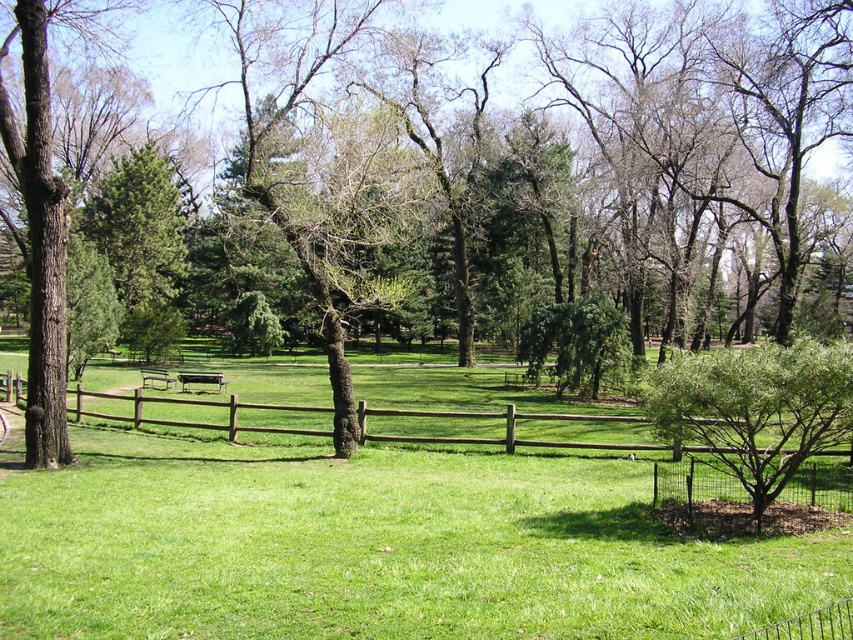
Which is more to the right, brown wood tree at center or green leafy bush at lower right?

From the viewer's perspective, green leafy bush at lower right appears more on the right side.

Which is behind, point (724, 228) or point (699, 413)?

Positioned behind is point (724, 228).

Image resolution: width=853 pixels, height=640 pixels. In order to click on brown wood tree at center in this screenshot , I will do `click(514, 173)`.

Can you confirm if brown wooden fence at center is positioned to the right of green leafy bush at lower right?

Incorrect, brown wooden fence at center is not on the right side of green leafy bush at lower right.

Which is behind, point (816, 500) or point (740, 428)?

Positioned behind is point (816, 500).

Identify the location of brown wooden fence at center. The image size is (853, 640). (398, 448).

Based on the photo, between brown wood tree at center and brown wooden fence at center, which one has less height?

With less height is brown wooden fence at center.

Does brown wood tree at center appear on the left side of brown wooden fence at center?

Indeed, brown wood tree at center is positioned on the left side of brown wooden fence at center.

Where is `brown wood tree at center`? brown wood tree at center is located at coordinates (514, 173).